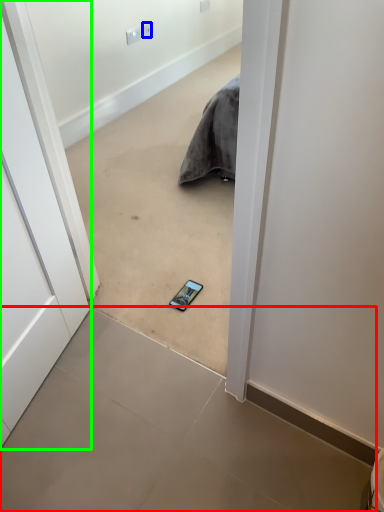
Question: Which object is positioned closest to concrete (highlighted by a red box)? Select from electric outlet (highlighted by a blue box) and door (highlighted by a green box).

Choices:
 (A) electric outlet
 (B) door

Answer: (B)